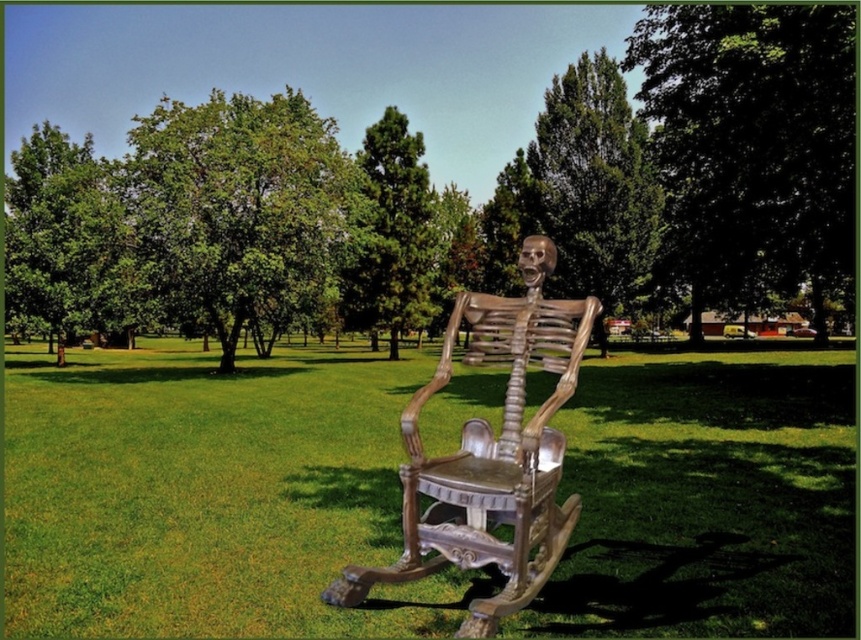
You are planning to set up a small picnic in the park shown in the image. You have a picnic blanket that can cover an area larger than the wooden rocking chair at center. Do you think the green grass at center will be big enough to accommodate your picnic blanket?

The green grass at center is larger in size than the wooden rocking chair at center. Since your picnic blanket can cover an area larger than the wooden rocking chair at center, the green grass at center should be big enough to accommodate your picnic blanket.

You are standing in the park and see the green grass at center and the wooden rocking chair at center. Which object is positioned to the right of the other?

The green grass at center is to the right of the wooden rocking chair at center, so the green grass at center is positioned to the right of the wooden rocking chair at center.